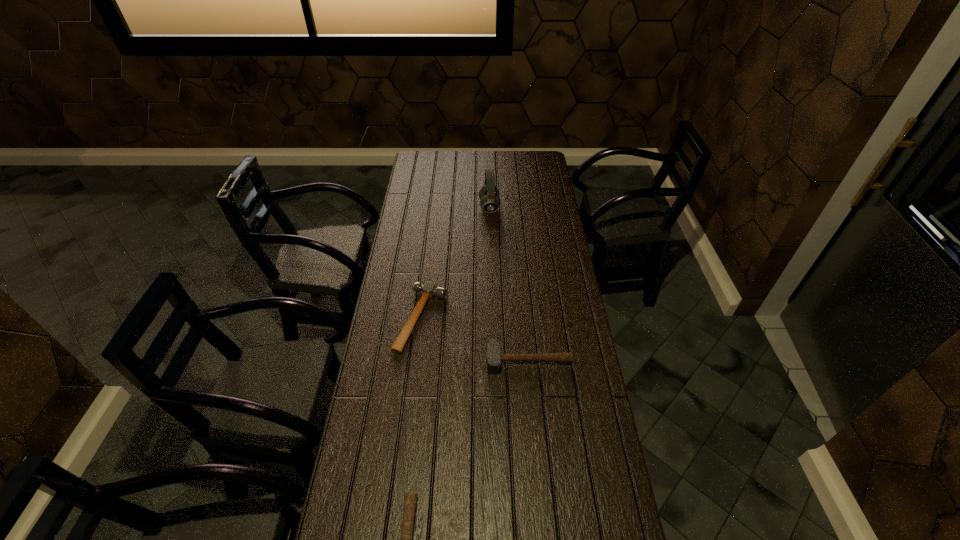
The height and width of the screenshot is (540, 960). In order to click on object that stands as the third closest to the headset in this screenshot , I will do `click(410, 499)`.

Locate which hammer ranks second in proximity to the nearest hammer. Please provide its 2D coordinates. Your answer should be formatted as a tuple, i.e. [(x, y)], where the tuple contains the x and y coordinates of a point satisfying the conditions above.

[(429, 289)]

Find the location of `hammer that is the closest one to the shortest hammer`. hammer that is the closest one to the shortest hammer is located at coordinates (493, 357).

Identify the location of free space that satisfies the following two spatial constraints: 1. on the ear cups of the farthest object; 2. on the front side of the second shortest object. (492, 319).